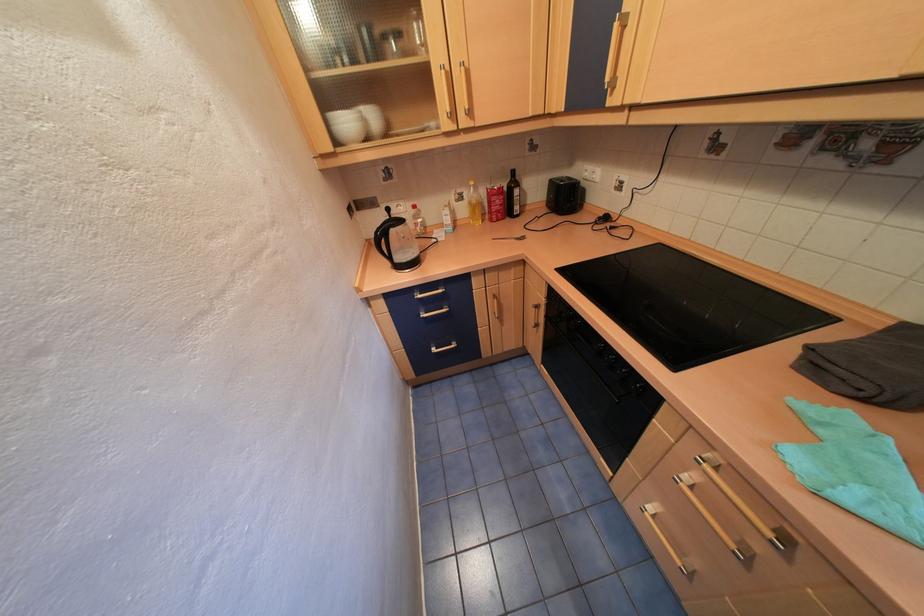
Which object does [513,196] point to?

It corresponds to the dark glass bottle in the image.